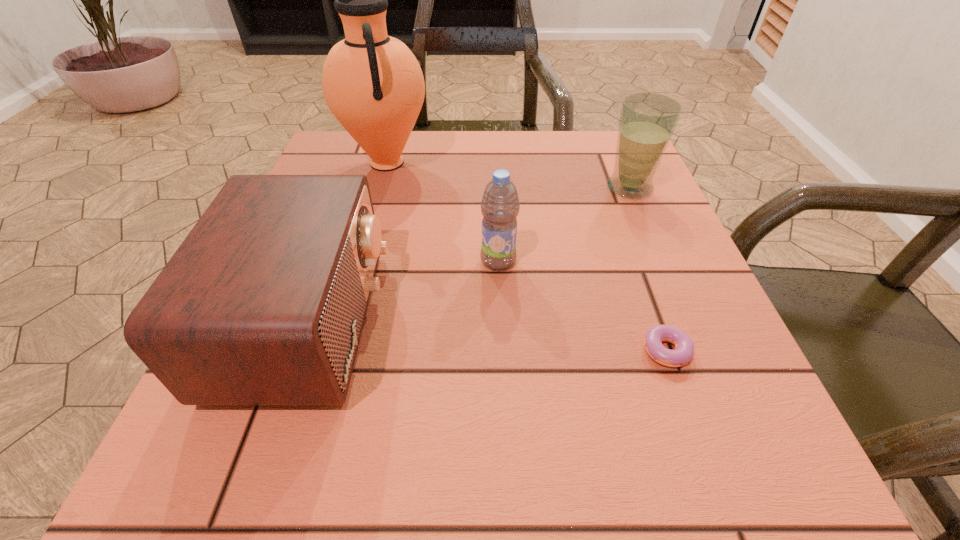
Identify the location of pitcher located at the far edge. This screenshot has height=540, width=960. (373, 84).

Identify the location of glass present at the far edge. The height and width of the screenshot is (540, 960). (647, 122).

Where is `pitcher that is at the left edge`? The height and width of the screenshot is (540, 960). pitcher that is at the left edge is located at coordinates (373, 84).

Where is `radio receiver located in the left edge section of the desktop`? This screenshot has height=540, width=960. radio receiver located in the left edge section of the desktop is located at coordinates (263, 303).

This screenshot has width=960, height=540. I want to click on glass positioned at the right edge, so click(647, 122).

The image size is (960, 540). In order to click on doughnut that is at the right edge in this screenshot , I will do `click(684, 348)`.

Image resolution: width=960 pixels, height=540 pixels. I want to click on object present at the far left corner, so click(373, 84).

In order to click on object at the far right corner in this screenshot , I will do `click(647, 122)`.

Where is `vacant space at the far edge`? This screenshot has height=540, width=960. vacant space at the far edge is located at coordinates (540, 135).

Where is `blank space at the near edge`? The height and width of the screenshot is (540, 960). blank space at the near edge is located at coordinates (377, 474).